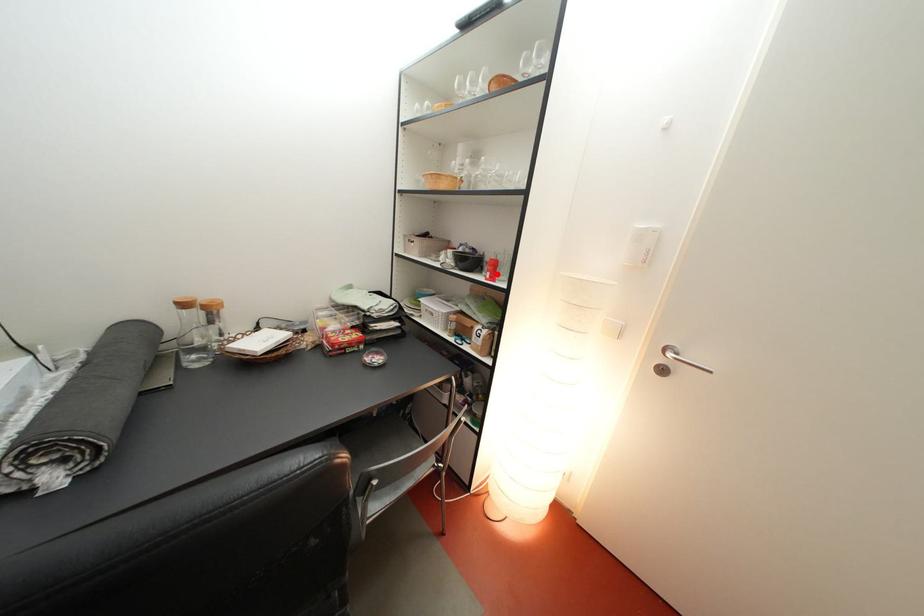
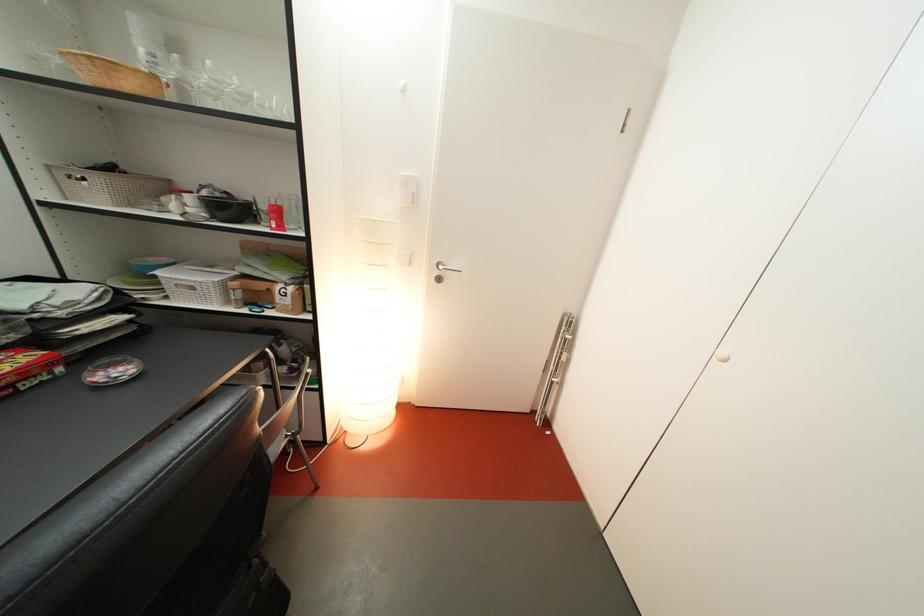
Locate, in the second image, the point that corresponds to the highlighted location in the first image.

(275, 223)